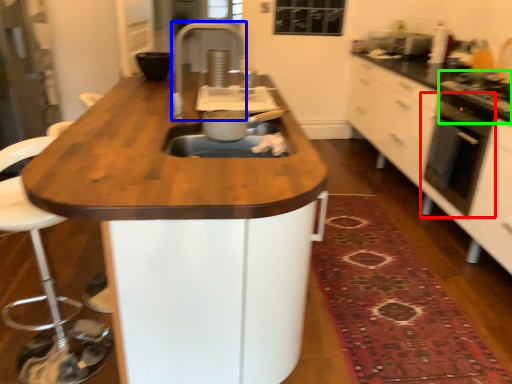
Question: Which object is positioned farthest from home appliance (highlighted by a red box)? Select from faucet (highlighted by a blue box) and gas stove (highlighted by a green box).

Choices:
 (A) faucet
 (B) gas stove

Answer: (A)